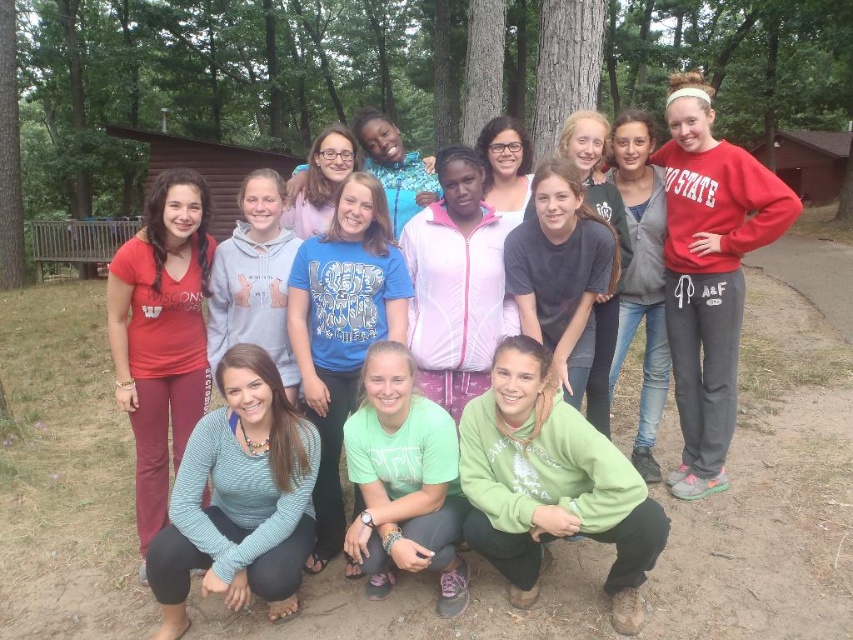
Question: Does blue cotton shirt at center have a smaller size compared to green fleece jacket at center?

Choices:
 (A) no
 (B) yes

Answer: (B)

Question: Can you confirm if matte red shirt at left is smaller than matte gray hoodie at center?

Choices:
 (A) no
 (B) yes

Answer: (B)

Question: Which point appears farthest from the camera in this image?

Choices:
 (A) (149, 547)
 (B) (318, 298)

Answer: (B)

Question: Among these objects, which one is nearest to the camera?

Choices:
 (A) striped knit sweater at lower center
 (B) matte red shirt at left
 (C) blue cotton shirt at center

Answer: (A)

Question: Among these points, which one is farthest from the camera?

Choices:
 (A) (229, 582)
 (B) (621, 152)

Answer: (B)

Question: Does matte red shirt at left have a greater width compared to matte gray hoodie at center?

Choices:
 (A) no
 (B) yes

Answer: (B)